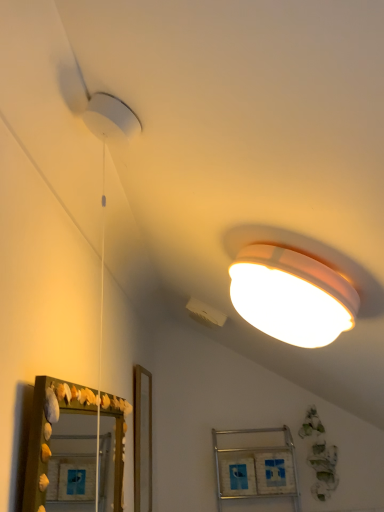
Question: Is metallic silver cabinet at lower center taller than wooden mirror at lower left?

Choices:
 (A) no
 (B) yes

Answer: (B)

Question: Is metallic silver cabinet at lower center closer to the viewer compared to wooden mirror at lower left?

Choices:
 (A) yes
 (B) no

Answer: (B)

Question: Is metallic silver cabinet at lower center next to wooden mirror at lower left and touching it?

Choices:
 (A) yes
 (B) no

Answer: (B)

Question: Is metallic silver cabinet at lower center behind wooden mirror at lower left?

Choices:
 (A) no
 (B) yes

Answer: (B)

Question: From the image's perspective, is metallic silver cabinet at lower center on top of wooden mirror at lower left?

Choices:
 (A) no
 (B) yes

Answer: (A)

Question: Can you confirm if metallic silver cabinet at lower center is positioned to the left of wooden mirror at lower left?

Choices:
 (A) no
 (B) yes

Answer: (A)

Question: From the image's perspective, is wooden mirror at lower left below metallic silver cabinet at lower center?

Choices:
 (A) no
 (B) yes

Answer: (A)

Question: From a real-world perspective, is wooden mirror at lower left positioned over metallic silver cabinet at lower center based on gravity?

Choices:
 (A) no
 (B) yes

Answer: (B)

Question: Does wooden mirror at lower left appear on the left side of metallic silver cabinet at lower center?

Choices:
 (A) yes
 (B) no

Answer: (A)

Question: Considering the relative positions of wooden mirror at lower left and metallic silver cabinet at lower center in the image provided, is wooden mirror at lower left in front of metallic silver cabinet at lower center?

Choices:
 (A) no
 (B) yes

Answer: (B)

Question: Does wooden mirror at lower left have a lesser width compared to metallic silver cabinet at lower center?

Choices:
 (A) yes
 (B) no

Answer: (A)

Question: From a real-world perspective, does wooden mirror at lower left sit lower than metallic silver cabinet at lower center?

Choices:
 (A) yes
 (B) no

Answer: (B)

Question: From the image's perspective, is wooden mirror at lower left located above or below metallic silver cabinet at lower center?

Choices:
 (A) below
 (B) above

Answer: (B)